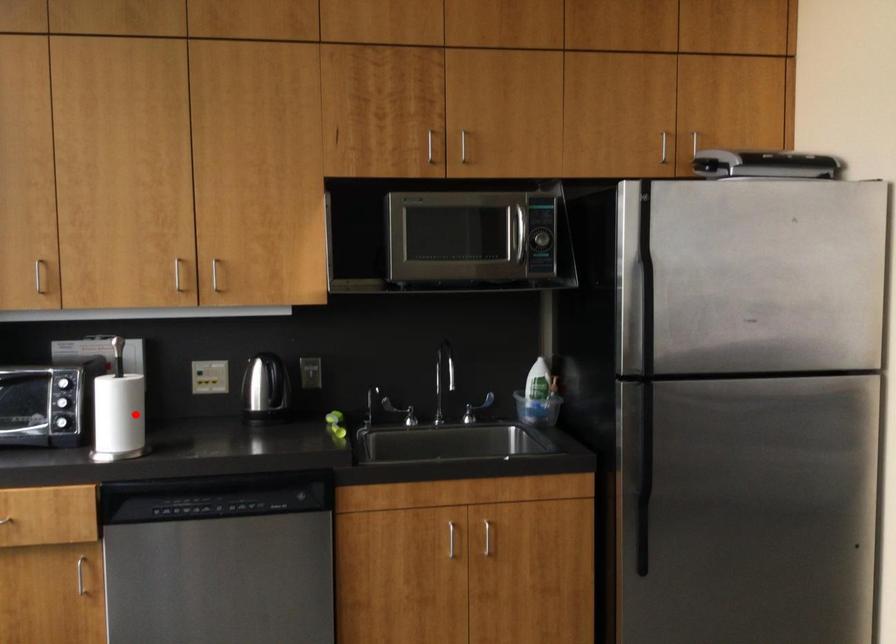
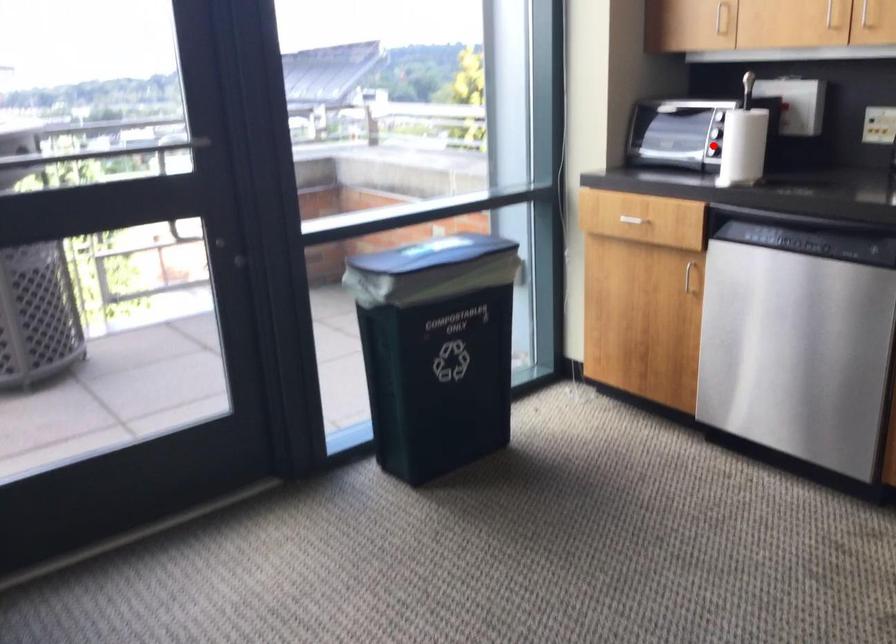
I am providing you with two images of the same scene from different viewpoints. A red point is marked on the first image and another point is marked on the second image. Does the point marked in image1 correspond to the same location as the one in image2?

No